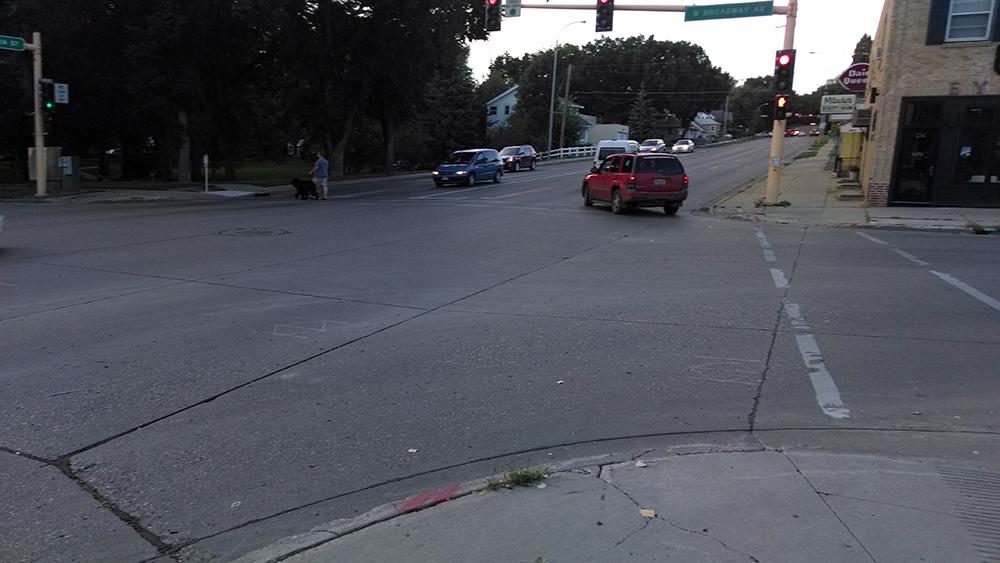
The height and width of the screenshot is (563, 1000). In order to click on window in this screenshot , I will do `click(974, 25)`.